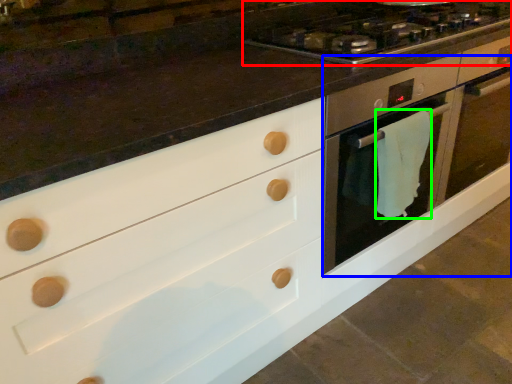
Question: Which object is positioned closest to gas stove (highlighted by a red box)? Select from oven (highlighted by a blue box) and material (highlighted by a green box).

Choices:
 (A) oven
 (B) material

Answer: (A)